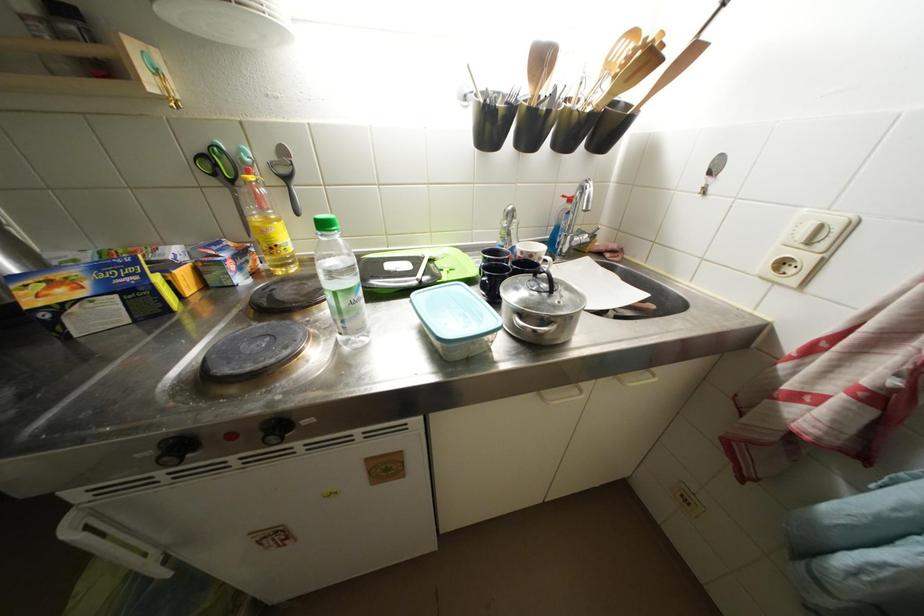
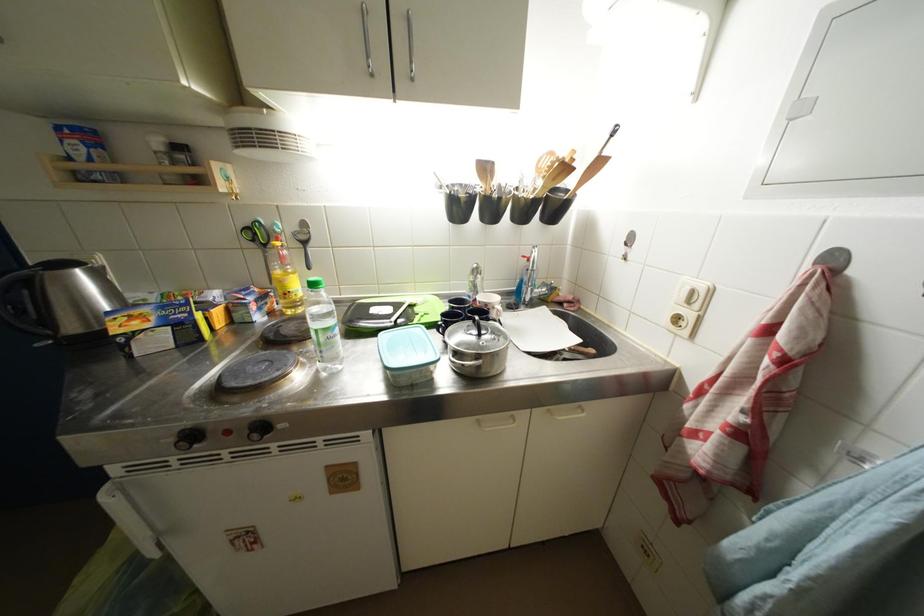
Where in the second image is the point corresponding to (286,430) from the first image?

(269, 431)